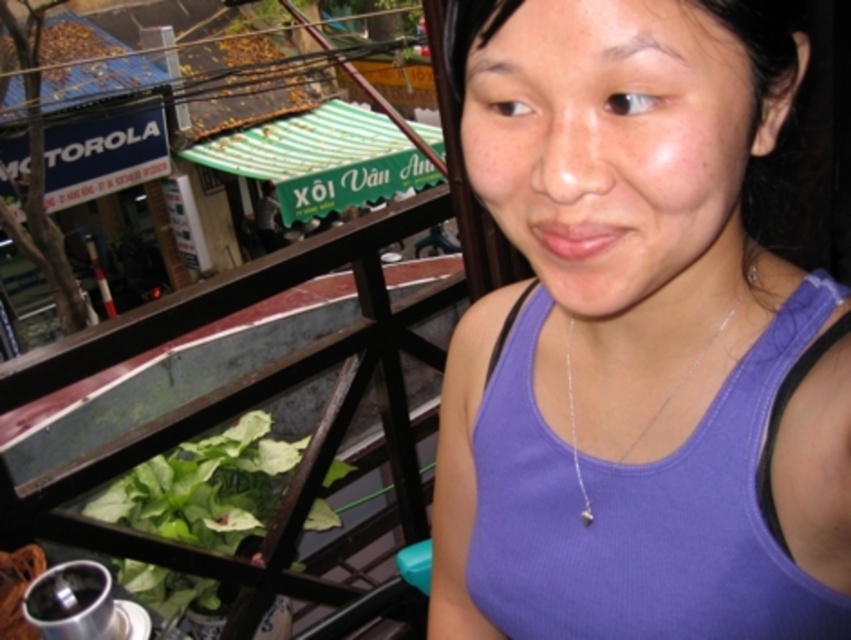
Which is more to the left, purple ribbed tank top at center or silver chain at center?

purple ribbed tank top at center is more to the left.

Between purple ribbed tank top at center and silver chain at center, which one has more height?

With more height is purple ribbed tank top at center.

From the picture: Who is more forward, (600, 48) or (575, 440)?

Positioned in front is point (600, 48).

In order to click on purple ribbed tank top at center in this screenshot , I will do `click(635, 339)`.